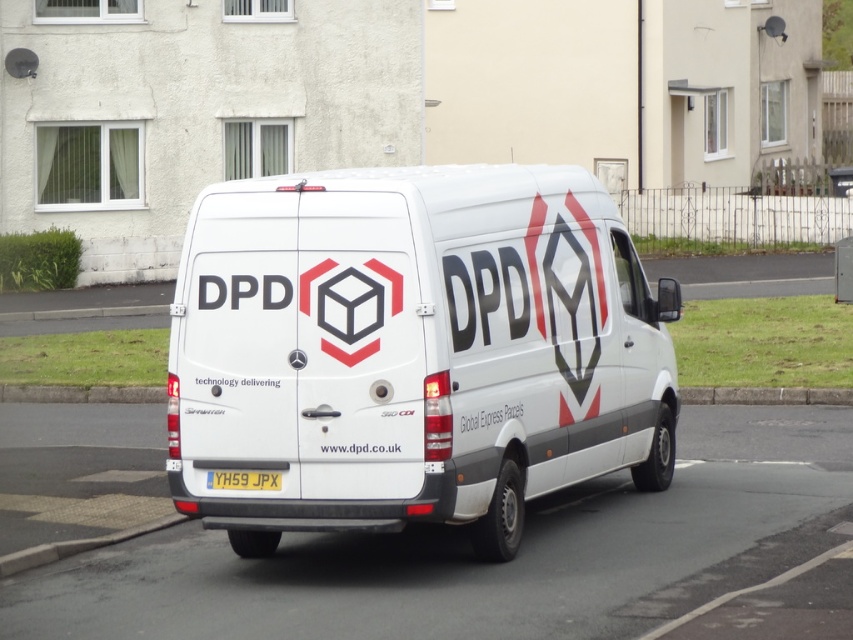
Question: Is white matte van at center to the left of yellow matte license plate at center from the viewer's perspective?

Choices:
 (A) yes
 (B) no

Answer: (B)

Question: Which of the following is the farthest from the observer?

Choices:
 (A) white matte van at center
 (B) yellow matte license plate at center

Answer: (B)

Question: Does white matte van at center lie in front of yellow matte license plate at center?

Choices:
 (A) yes
 (B) no

Answer: (A)

Question: Is white matte van at center closer to camera compared to yellow matte license plate at center?

Choices:
 (A) yes
 (B) no

Answer: (A)

Question: Which point is closer to the camera?

Choices:
 (A) white matte van at center
 (B) yellow matte license plate at center

Answer: (A)